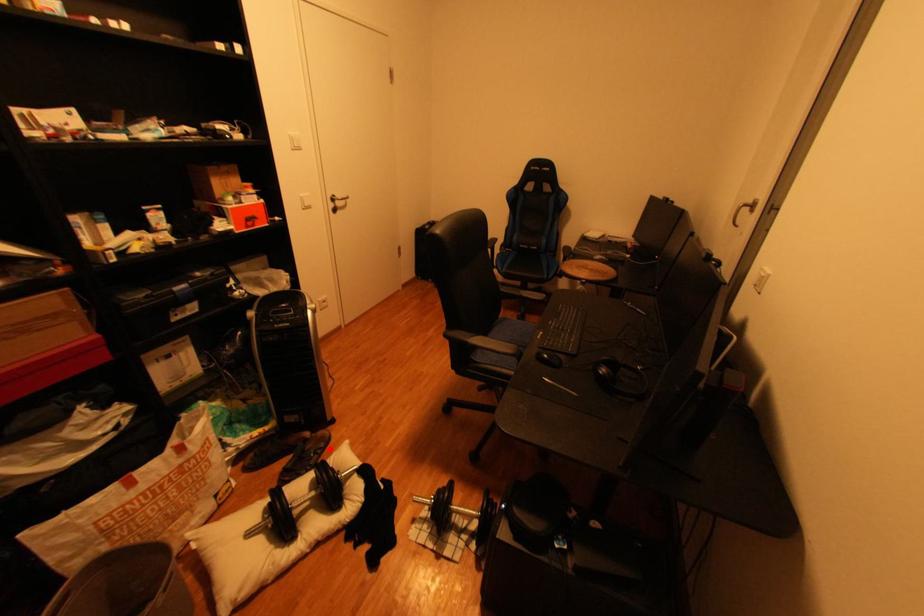
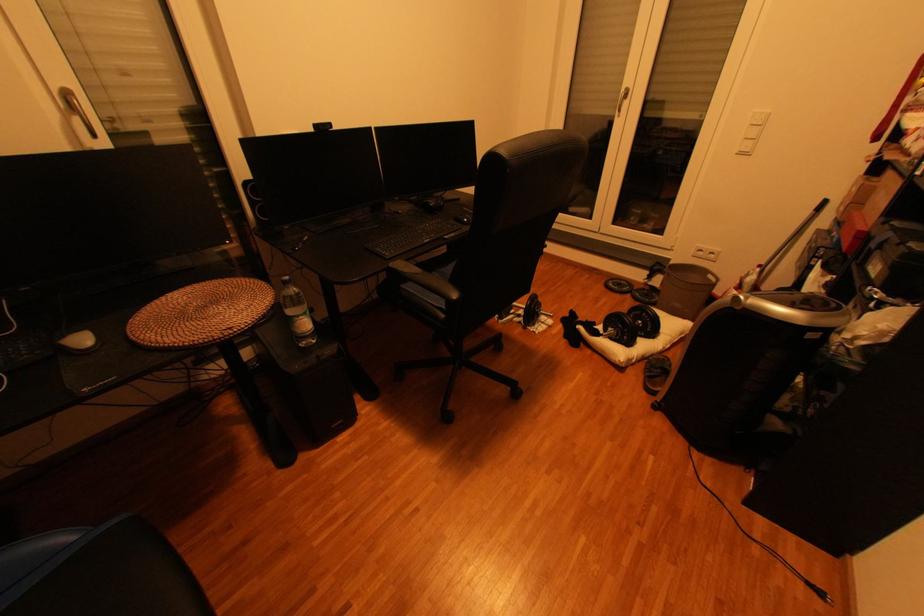
Question: I am providing you with two images of the same scene from different viewpoints. A red point is shown in image1. For the corresponding object point in image2, is it positioned nearer or farther from the camera?

Choices:
 (A) Nearer
 (B) Farther

Answer: (B)